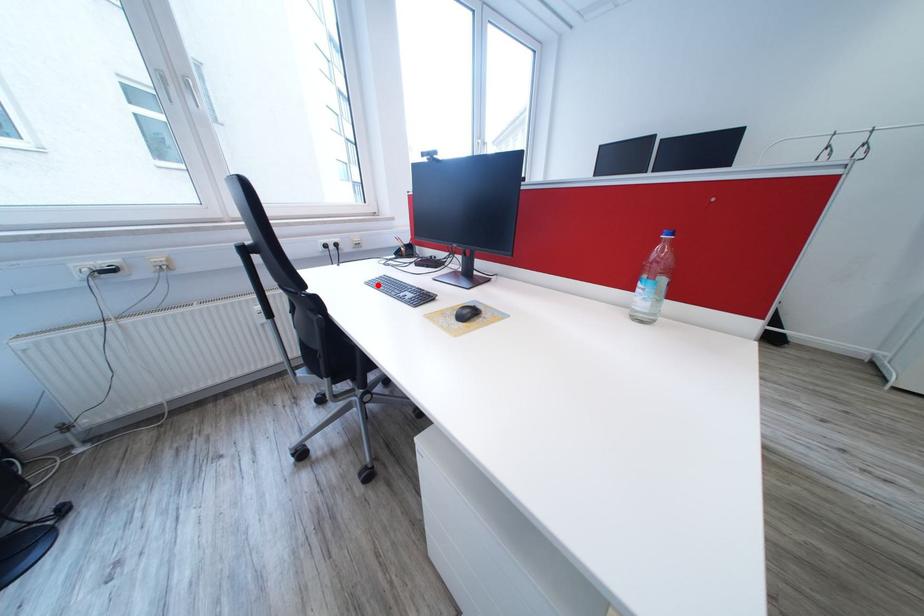
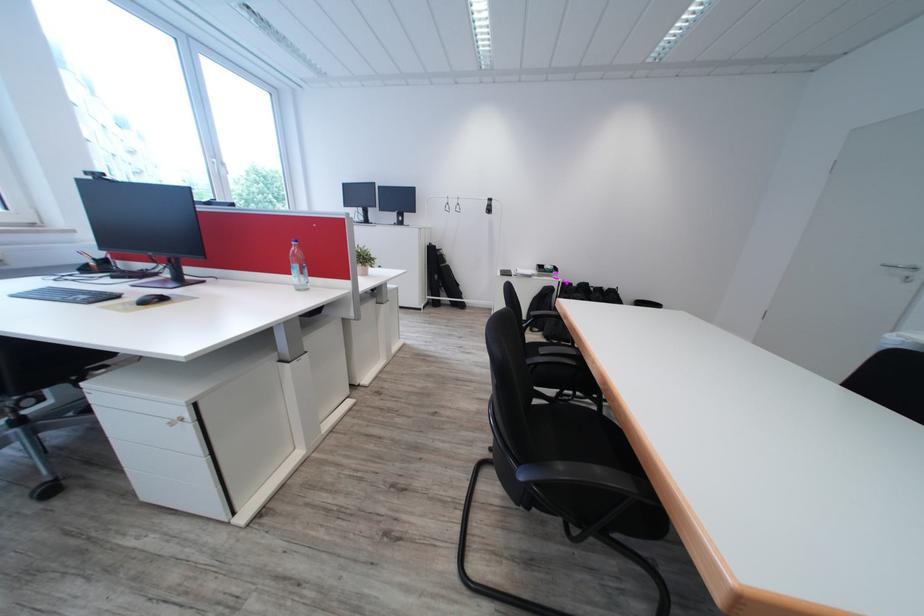
In the second image, find the point that corresponds to the highlighted location in the first image.

(26, 298)